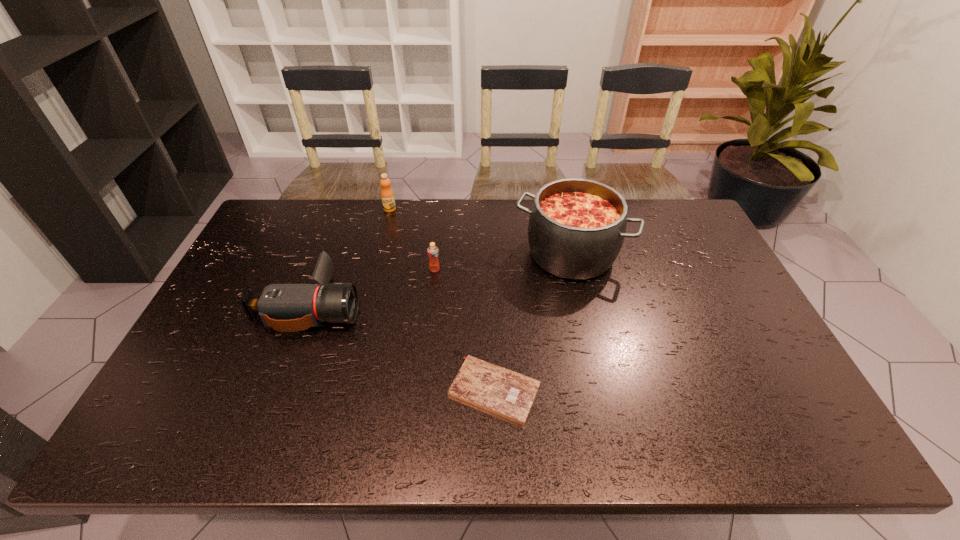
Where is `free area in between the taller orange juice and the camcorder`? free area in between the taller orange juice and the camcorder is located at coordinates (350, 257).

The height and width of the screenshot is (540, 960). What are the coordinates of `vacant area that lies between the farthest object and the third object from left to right` in the screenshot? It's located at (412, 239).

Identify which object is located as the fourth nearest to the left orange juice. Please provide its 2D coordinates. Your answer should be formatted as a tuple, i.e. [(x, y)], where the tuple contains the x and y coordinates of a point satisfying the conditions above.

[(503, 392)]

I want to click on object that stands as the third closest to the shorter orange juice, so click(387, 195).

The width and height of the screenshot is (960, 540). In order to click on vacant space that satisfies the following two spatial constraints: 1. on the front side of the shorter orange juice; 2. on the lens of the camcorder in this screenshot , I will do `click(431, 306)`.

Where is `blank area in the image that satisfies the following two spatial constraints: 1. on the front label of the left orange juice; 2. on the left side of the nearest object`? This screenshot has height=540, width=960. blank area in the image that satisfies the following two spatial constraints: 1. on the front label of the left orange juice; 2. on the left side of the nearest object is located at coordinates (345, 390).

Image resolution: width=960 pixels, height=540 pixels. Identify the location of free point that satisfies the following two spatial constraints: 1. on the front label of the farther orange juice; 2. on the right side of the Bible. (345, 390).

You are a GUI agent. You are given a task and a screenshot of the screen. Output one action in this format:
    pyautogui.click(x=<x>, y=<y>)
    Task: Click on the vacant region that satisfies the following two spatial constraints: 1. on the front label of the farther orange juice; 2. on the right side of the nearest object
    
    Given the screenshot: What is the action you would take?
    (345, 390)